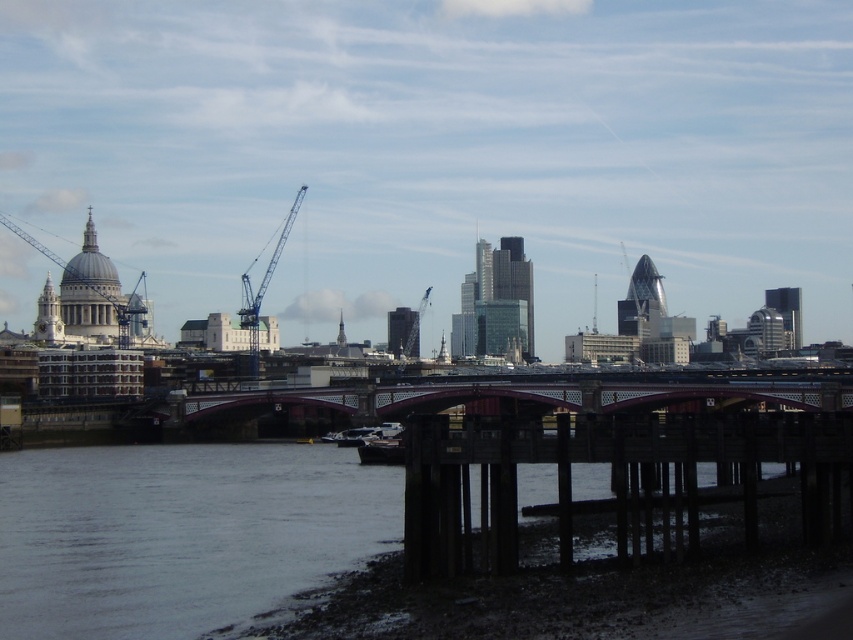
Question: Estimate the real-world distances between objects in this image. Which object is closer to the metallic gray crane at center?

Choices:
 (A) blue metallic crane at center
 (B) metallic blue crane at upper left
 (C) dark wood dock at lower right

Answer: (A)

Question: Which object is farther from the camera taking this photo?

Choices:
 (A) metallic gray crane at center
 (B) dark wood dock at lower right
 (C) metallic blue crane at upper left
 (D) metallic gray boat at center

Answer: (A)

Question: Is dark wood dock at lower right wider than blue metallic crane at center?

Choices:
 (A) no
 (B) yes

Answer: (B)

Question: Which of these objects is positioned closest to the dark gray metallic boat at center?

Choices:
 (A) metallic blue crane at upper left
 (B) metallic gray crane at center

Answer: (A)

Question: From the image, what is the correct spatial relationship of blue metallic crane at center in relation to metallic gray boat at center?

Choices:
 (A) left
 (B) right

Answer: (A)

Question: Observing the image, what is the correct spatial positioning of blue metallic crane at center in reference to dark gray metallic boat at center?

Choices:
 (A) above
 (B) below

Answer: (A)